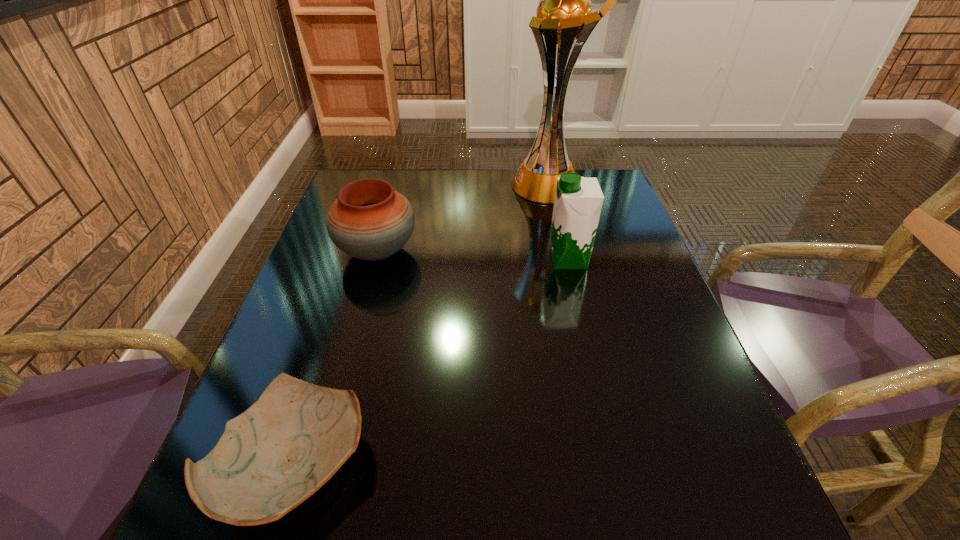
This screenshot has height=540, width=960. I want to click on free location located 0.310m on the front-facing side of the soya milk, so click(x=424, y=259).

Identify the location of free space located on the right of the second shortest object. (512, 252).

Find the location of `object at the far edge`. object at the far edge is located at coordinates [564, 22].

The width and height of the screenshot is (960, 540). Find the location of `object at the left edge`. object at the left edge is located at coordinates (369, 220).

Identify the location of trophy that is at the right edge. This screenshot has width=960, height=540. (564, 22).

Find the location of a particular element. Image resolution: width=960 pixels, height=540 pixels. soya milk at the right edge is located at coordinates (578, 201).

Locate an element on the screen. This screenshot has height=540, width=960. object present at the far right corner is located at coordinates (564, 22).

In the image, there is a desktop. At what (x,y) coordinates should I click in order to perform the action: click on vacant space at the far edge. Please return your answer as a coordinate pair (x, y). Looking at the image, I should click on (447, 176).

Image resolution: width=960 pixels, height=540 pixels. Find the location of `vacant space at the left edge of the desktop`. vacant space at the left edge of the desktop is located at coordinates (306, 286).

Where is `vacant point at the right edge`? The width and height of the screenshot is (960, 540). vacant point at the right edge is located at coordinates (633, 231).